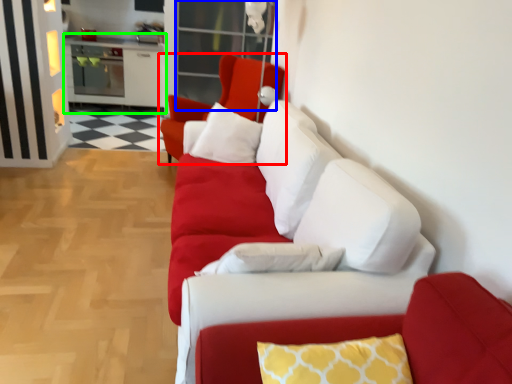
Question: Which object is the farthest from chair (highlighted by a red box)? Choose among these: glass door (highlighted by a blue box) or entertainment center (highlighted by a green box).

Choices:
 (A) glass door
 (B) entertainment center

Answer: (B)